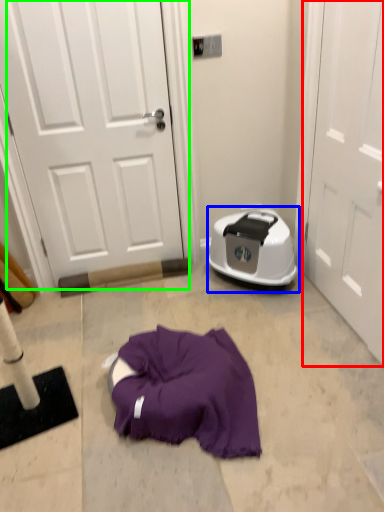
Question: Which object is positioned closest to door (highlighted by a red box)? Select from dish washer (highlighted by a blue box) and door (highlighted by a green box).

Choices:
 (A) dish washer
 (B) door

Answer: (A)